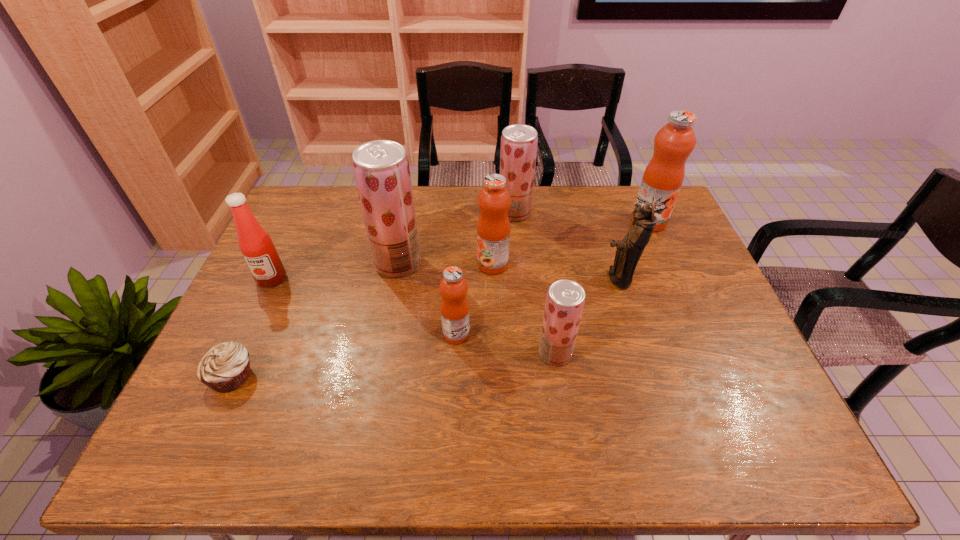
The image size is (960, 540). Identify the location of vacant region between the nearest strawberry fruit juice and the rightmost fruit juice. (602, 287).

Where is `empty space that is in between the smallest strawberry fruit juice and the smallest orange fruit juice`? The image size is (960, 540). empty space that is in between the smallest strawberry fruit juice and the smallest orange fruit juice is located at coordinates (506, 343).

At what (x,y) coordinates should I click in order to perform the action: click on free space that is in between the second farthest strawberry fruit juice and the condiment. Please return your answer as a coordinate pair (x, y). The height and width of the screenshot is (540, 960). Looking at the image, I should click on (335, 271).

Locate which object is the third closest to the nearest strawberry fruit juice. Please provide its 2D coordinates. Your answer should be formatted as a tuple, i.e. [(x, y)], where the tuple contains the x and y coordinates of a point satisfying the conditions above.

[(493, 228)]

Select which object is the eighth closest to the second nearest orange fruit juice. Please provide its 2D coordinates. Your answer should be formatted as a tuple, i.e. [(x, y)], where the tuple contains the x and y coordinates of a point satisfying the conditions above.

[(224, 368)]

Image resolution: width=960 pixels, height=540 pixels. I want to click on fruit juice that stands as the fourth closest to the farthest orange fruit juice, so click(x=454, y=307).

At what (x,y) coordinates should I click in order to perform the action: click on fruit juice that is the fourth closest to the leftmost strawberry fruit juice. Please return your answer as a coordinate pair (x, y). The image size is (960, 540). Looking at the image, I should click on (565, 300).

Choose which strawberry fruit juice is the nearest neighbor to the second orange fruit juice from right to left. Please provide its 2D coordinates. Your answer should be formatted as a tuple, i.e. [(x, y)], where the tuple contains the x and y coordinates of a point satisfying the conditions above.

[(519, 142)]

The height and width of the screenshot is (540, 960). Find the location of `the closest strawberry fruit juice to the farthest strawberry fruit juice`. the closest strawberry fruit juice to the farthest strawberry fruit juice is located at coordinates (381, 168).

The image size is (960, 540). Find the location of `the second closest orange fruit juice to the biggest orange fruit juice`. the second closest orange fruit juice to the biggest orange fruit juice is located at coordinates (454, 307).